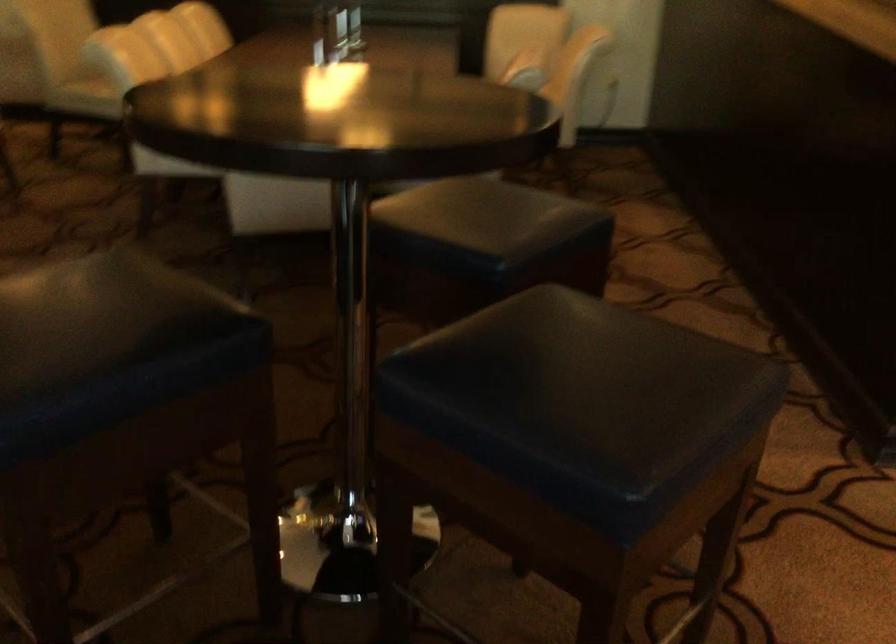
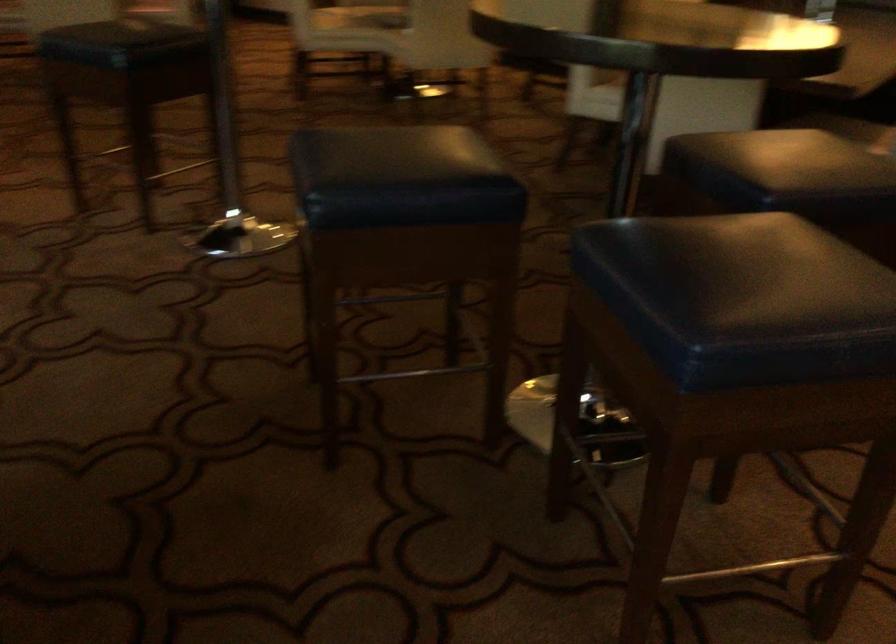
Where in the second image is the point corresponding to [119,364] from the first image?

(401, 178)